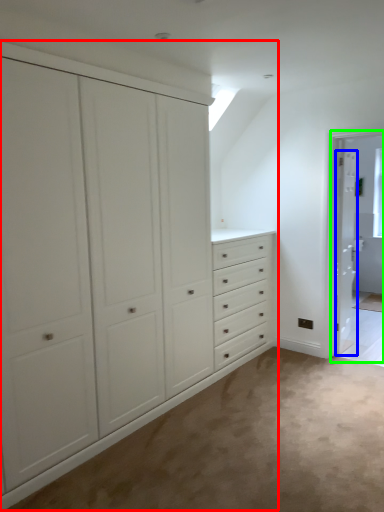
Question: Based on their relative distances, which object is nearer to cupboard (highlighted by a red box)? Choose from door (highlighted by a blue box) and screen door (highlighted by a green box).

Choices:
 (A) door
 (B) screen door

Answer: (B)